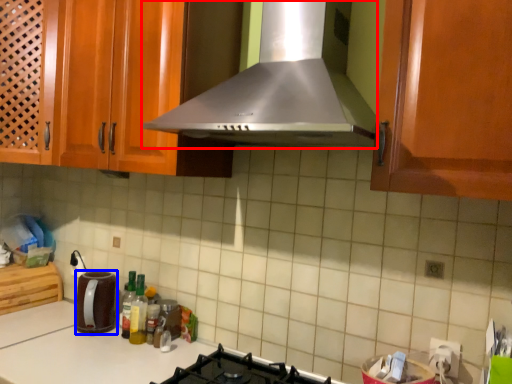
Question: Which object is further to the camera taking this photo, home appliance (highlighted by a red box) or kitchen appliance (highlighted by a blue box)?

Choices:
 (A) home appliance
 (B) kitchen appliance

Answer: (B)